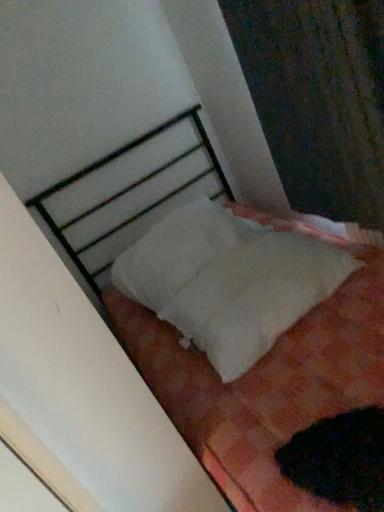
This screenshot has width=384, height=512. What do you see at coordinates (255, 296) in the screenshot?
I see `white soft fabric at center` at bounding box center [255, 296].

The height and width of the screenshot is (512, 384). I want to click on white fabric curtain at upper right, so click(x=318, y=99).

From a real-world perspective, which object rests below the other?

white soft fabric at center.

Would you say white fabric curtain at upper right is part of white soft fabric at center's contents?

Definitely not — white fabric curtain at upper right is not inside white soft fabric at center.

How different are the orientations of white soft fabric at center and white fabric curtain at upper right in degrees?

There is a 93.6-degree angle between the facing directions of white soft fabric at center and white fabric curtain at upper right.

How far apart are white soft fabric at center and white fabric curtain at upper right?

white soft fabric at center and white fabric curtain at upper right are 19.60 inches apart.

Is black fuzzy cat at lower right further to the viewer compared to white fabric curtain at upper right?

No, black fuzzy cat at lower right is closer to the viewer.

Can you confirm if black fuzzy cat at lower right is positioned to the left of white fabric curtain at upper right?

Yes.

Is the surface of black fuzzy cat at lower right in direct contact with white fabric curtain at upper right?

black fuzzy cat at lower right and white fabric curtain at upper right are clearly separated.

Locate an element on the screen. The width and height of the screenshot is (384, 512). curtain that appears above the black fuzzy cat at lower right (from a real-world perspective) is located at coordinates (318, 99).

Which is more to the left, white soft fabric at center or white soft pillow at center?

white soft pillow at center is more to the left.

Can we say white soft fabric at center lies outside white soft pillow at center?

Yes.

Looking at their sizes, would you say white soft fabric at center is wider or thinner than white soft pillow at center?

Clearly, white soft fabric at center has less width compared to white soft pillow at center.

Considering the positions of point (263, 315) and point (152, 240), is point (263, 315) closer or farther from the camera than point (152, 240)?

Clearly, point (263, 315) is closer to the camera than point (152, 240).

Between white fabric curtain at upper right and white soft fabric at center, which one is positioned behind?

Positioned behind is white soft fabric at center.

How many degrees apart are the facing directions of white fabric curtain at upper right and white soft fabric at center?

93.6 degrees separate the facing orientations of white fabric curtain at upper right and white soft fabric at center.

From the picture: Is white fabric curtain at upper right directly adjacent to white soft fabric at center?

No.

Find the location of a particular element. This screenshot has height=512, width=384. curtain on the right of the white soft fabric at center is located at coordinates (318, 99).

Is white soft fabric at center surrounded by white soft pillow at center?

No, white soft pillow at center does not contain white soft fabric at center.

From the picture: Can you confirm if white soft pillow at center is bigger than white soft fabric at center?

Yes.

Does white soft pillow at center have a greater height compared to white soft fabric at center?

Yes.

Consider the image. Can you confirm if white soft pillow at center is wider than white soft fabric at center?

Indeed, white soft pillow at center has a greater width compared to white soft fabric at center.

Considering the points (311, 243) and (310, 465), which point is behind, point (311, 243) or point (310, 465)?

The point (311, 243) is farther.

Considering the sizes of objects white soft fabric at center and black fuzzy cat at lower right in the image provided, who is bigger, white soft fabric at center or black fuzzy cat at lower right?

white soft fabric at center is bigger.

From the image's perspective, is white soft fabric at center beneath black fuzzy cat at lower right?

No, from the image's perspective, white soft fabric at center is not below black fuzzy cat at lower right.

From a real-world perspective, is white soft fabric at center physically above black fuzzy cat at lower right?

Yes, from a real-world perspective, white soft fabric at center is on top of black fuzzy cat at lower right.

Which object is further away from the camera, white soft pillow at center or white fabric curtain at upper right?

white soft pillow at center is more distant.

Does white soft pillow at center have a larger size compared to white fabric curtain at upper right?

Actually, white soft pillow at center might be smaller than white fabric curtain at upper right.

How far apart are white soft pillow at center and white fabric curtain at upper right?

The distance of white soft pillow at center from white fabric curtain at upper right is 22.65 inches.

Identify the location of curtain located above the white soft fabric at center (from a real-world perspective). The width and height of the screenshot is (384, 512). (318, 99).

Where is `curtain that appears behind the black fuzzy cat at lower right`? curtain that appears behind the black fuzzy cat at lower right is located at coordinates (318, 99).

Estimate the real-world distances between objects in this image. Which object is closer to white soft pillow at center, white soft fabric at center or black fuzzy cat at lower right?

white soft fabric at center lies closer to white soft pillow at center than the other object.

From the image, which object appears to be nearer to white fabric curtain at upper right, black fuzzy cat at lower right or white soft fabric at center?

white soft fabric at center is closer to white fabric curtain at upper right.

Considering their positions, is black fuzzy cat at lower right positioned further to white soft pillow at center than white soft fabric at center?

black fuzzy cat at lower right.

From the image, which object appears to be nearer to white soft pillow at center, white soft fabric at center or white fabric curtain at upper right?

white soft fabric at center.

Which object lies further to the anchor point black fuzzy cat at lower right, white soft fabric at center or white fabric curtain at upper right?

The object further to black fuzzy cat at lower right is white fabric curtain at upper right.

Which object lies further to the anchor point black fuzzy cat at lower right, white soft fabric at center or white soft pillow at center?

white soft pillow at center.

From the image, which object appears to be farther from white soft pillow at center, black fuzzy cat at lower right or white fabric curtain at upper right?

black fuzzy cat at lower right is further to white soft pillow at center.

Considering their positions, is white soft pillow at center positioned further to white fabric curtain at upper right than black fuzzy cat at lower right?

black fuzzy cat at lower right is positioned further to the anchor white fabric curtain at upper right.

The height and width of the screenshot is (512, 384). What are the coordinates of `pillow between white fabric curtain at upper right and black fuzzy cat at lower right in the vertical direction` in the screenshot? It's located at (177, 252).

Where is `sheet between white fabric curtain at upper right and black fuzzy cat at lower right vertically`? This screenshot has width=384, height=512. sheet between white fabric curtain at upper right and black fuzzy cat at lower right vertically is located at coordinates (255, 296).

Locate an element on the screen. The width and height of the screenshot is (384, 512). pillow that lies between white fabric curtain at upper right and white soft fabric at center from top to bottom is located at coordinates (177, 252).

I want to click on sheet located between black fuzzy cat at lower right and white soft pillow at center in the depth direction, so click(x=255, y=296).